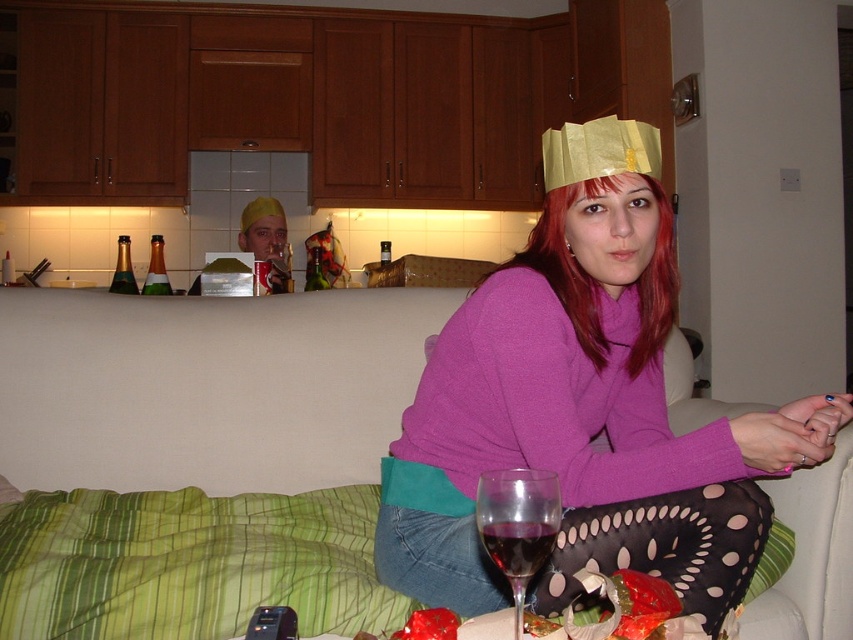
Question: Does green fabric couch at lower center appear on the right side of transparent glass at lower center?

Choices:
 (A) yes
 (B) no

Answer: (B)

Question: Which point is farther to the camera?

Choices:
 (A) (639, 202)
 (B) (451, 307)
 (C) (242, 232)

Answer: (C)

Question: Which object is farther from the camera taking this photo?

Choices:
 (A) matte gold crown at upper center
 (B) dark purple glass at lower center

Answer: (A)

Question: Does transparent glass at lower center come behind dark purple glass at lower center?

Choices:
 (A) yes
 (B) no

Answer: (B)

Question: Which object is closer to the camera taking this photo?

Choices:
 (A) green fabric couch at lower center
 (B) gold paper crown at upper center
 (C) transparent glass at lower center
 (D) dark purple glass at lower center

Answer: (C)

Question: Considering the relative positions of transparent glass at lower center and gold paper crown at upper center in the image provided, where is transparent glass at lower center located with respect to gold paper crown at upper center?

Choices:
 (A) right
 (B) left

Answer: (B)